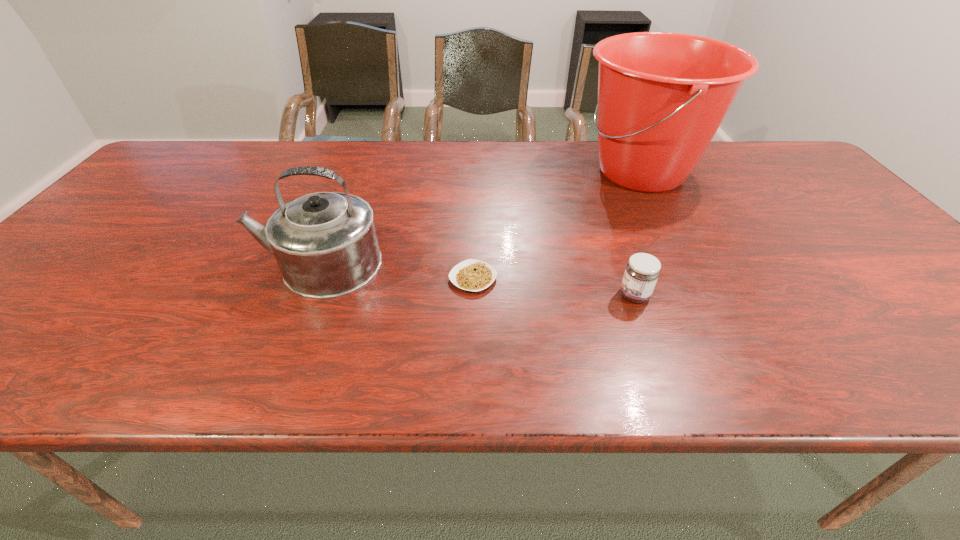
Identify the location of free region located 0.170m with the spout at the front of the leftmost object. (180, 265).

Where is `vacant space located 0.230m with the spout at the front of the leftmost object`? The width and height of the screenshot is (960, 540). vacant space located 0.230m with the spout at the front of the leftmost object is located at coordinates click(155, 265).

Where is `free region located with the spout at the front of the leftmost object`? The width and height of the screenshot is (960, 540). free region located with the spout at the front of the leftmost object is located at coordinates (232, 265).

Find the location of a particular element. This screenshot has height=540, width=960. free space located on the front label of the jam is located at coordinates (443, 295).

Locate an element on the screen. This screenshot has height=540, width=960. blank area located 0.290m on the front label of the jam is located at coordinates (484, 295).

At what (x,y) coordinates should I click in order to perform the action: click on free location located 0.280m on the front label of the jam. Please return your answer as a coordinate pair (x, y). Looking at the image, I should click on (489, 295).

Locate an element on the screen. This screenshot has height=540, width=960. free space located 0.380m on the back of the second object from left to right is located at coordinates (474, 178).

Locate an element on the screen. The width and height of the screenshot is (960, 540). object present at the far edge is located at coordinates (662, 96).

Identify the location of free location at the far edge. This screenshot has height=540, width=960. (278, 160).

In order to click on free space at the near edge of the desktop in this screenshot , I will do `click(63, 348)`.